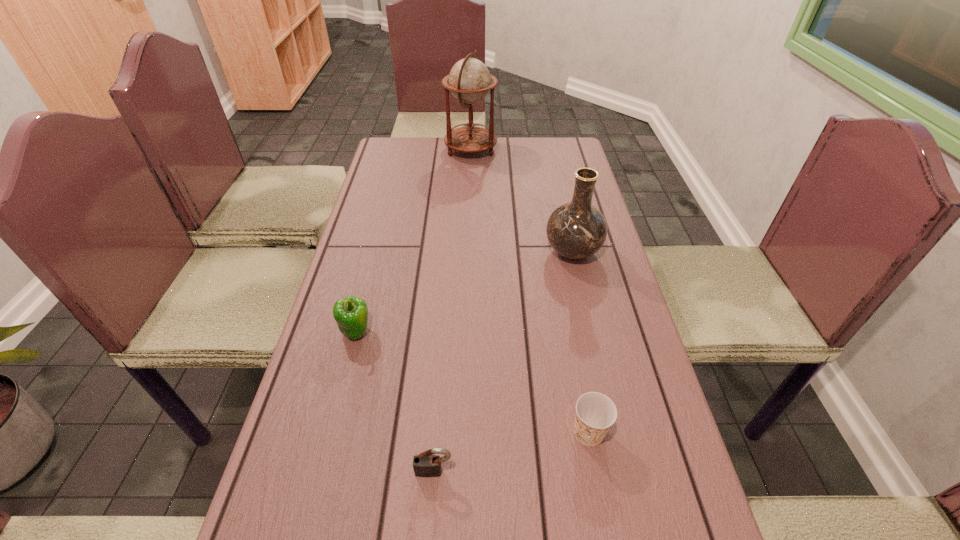
Identify the location of vacant point that satisfies the following two spatial constraints: 1. on the surface of the vase; 2. on the right side of the tallest object. (468, 252).